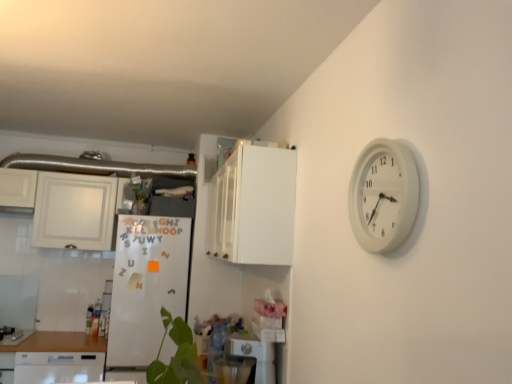
Question: Can you confirm if brushed metal gas stove at lower left is wider than white glossy cabinet at upper left, marked as the first cabinetry in a left-to-right arrangement?

Choices:
 (A) yes
 (B) no

Answer: (A)

Question: Is brushed metal gas stove at lower left at the right side of white glossy cabinet at upper left, marked as the first cabinetry in a left-to-right arrangement?

Choices:
 (A) no
 (B) yes

Answer: (A)

Question: Is brushed metal gas stove at lower left oriented towards white glossy cabinet at upper left, the 1th cabinetry when ordered from back to front?

Choices:
 (A) no
 (B) yes

Answer: (A)

Question: Are brushed metal gas stove at lower left and white glossy cabinet at upper left, the 1th cabinetry when ordered from back to front, located far from each other?

Choices:
 (A) no
 (B) yes

Answer: (B)

Question: Considering the relative sizes of brushed metal gas stove at lower left and white glossy cabinet at upper left, marked as the first cabinetry in a left-to-right arrangement, in the image provided, is brushed metal gas stove at lower left smaller than white glossy cabinet at upper left, marked as the first cabinetry in a left-to-right arrangement,?

Choices:
 (A) yes
 (B) no

Answer: (A)

Question: Is white matte refrigerator at center-left wider or thinner than white plastic dishwasher at lower center?

Choices:
 (A) wide
 (B) thin

Answer: (A)

Question: From their relative heights in the image, would you say white matte refrigerator at center-left is taller or shorter than white plastic dishwasher at lower center?

Choices:
 (A) short
 (B) tall

Answer: (B)

Question: In terms of size, does white matte refrigerator at center-left appear bigger or smaller than white plastic dishwasher at lower center?

Choices:
 (A) big
 (B) small

Answer: (A)

Question: Visually, is white matte refrigerator at center-left positioned to the left or to the right of white plastic dishwasher at lower center?

Choices:
 (A) right
 (B) left

Answer: (B)

Question: Considering the relative positions of white matte refrigerator at center-left and brushed metal gas stove at lower left in the image provided, is white matte refrigerator at center-left to the left or to the right of brushed metal gas stove at lower left?

Choices:
 (A) right
 (B) left

Answer: (A)

Question: From a real-world perspective, is white matte refrigerator at center-left positioned above or below brushed metal gas stove at lower left?

Choices:
 (A) above
 (B) below

Answer: (A)

Question: From the image's perspective, relative to brushed metal gas stove at lower left, is white matte refrigerator at center-left above or below?

Choices:
 (A) below
 (B) above

Answer: (B)

Question: Considering the positions of white matte refrigerator at center-left and brushed metal gas stove at lower left in the image, is white matte refrigerator at center-left bigger or smaller than brushed metal gas stove at lower left?

Choices:
 (A) small
 (B) big

Answer: (B)

Question: Relative to white plastic dishwasher at lower center, is brushed metal gas stove at lower left in front or behind?

Choices:
 (A) front
 (B) behind

Answer: (B)

Question: Is brushed metal gas stove at lower left to the left or to the right of white plastic dishwasher at lower center in the image?

Choices:
 (A) right
 (B) left

Answer: (B)